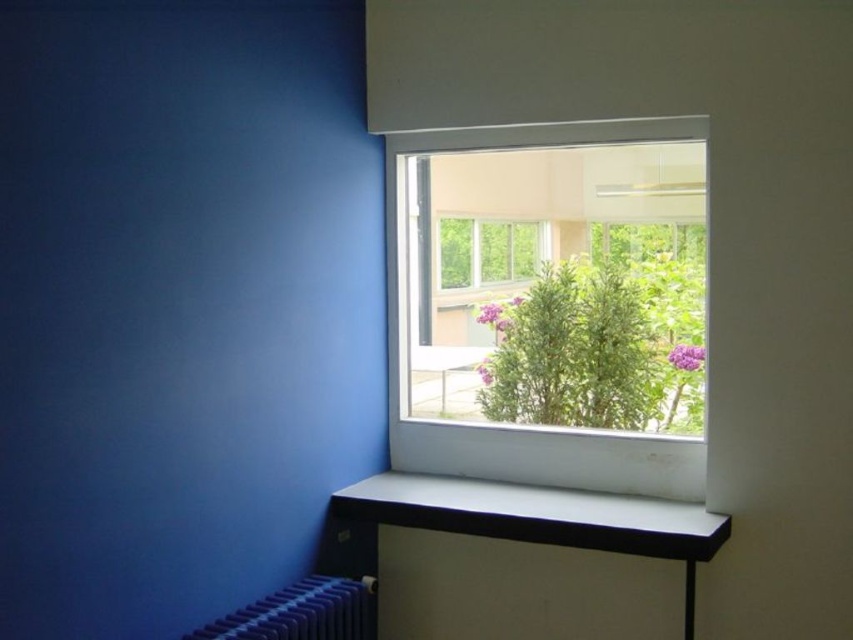
Question: Which point appears farthest from the camera in this image?

Choices:
 (A) (647, 272)
 (B) (393, 506)
 (C) (646, 472)
 (D) (490, 243)

Answer: (D)

Question: Among these points, which one is nearest to the camera?

Choices:
 (A) (589, 276)
 (B) (439, 221)
 (C) (529, 144)

Answer: (C)

Question: Is white glossy window sill at lower center behind blue metallic radiator at lower left?

Choices:
 (A) yes
 (B) no

Answer: (A)

Question: Can you confirm if white plastic window at upper center is positioned to the right of clear glass window at center?

Choices:
 (A) yes
 (B) no

Answer: (A)

Question: Does white glossy window sill at lower center appear over clear glass window at center?

Choices:
 (A) yes
 (B) no

Answer: (B)

Question: Which object is positioned farthest from the clear glass window at center?

Choices:
 (A) white plastic window at upper center
 (B) green leafy plant at center

Answer: (A)